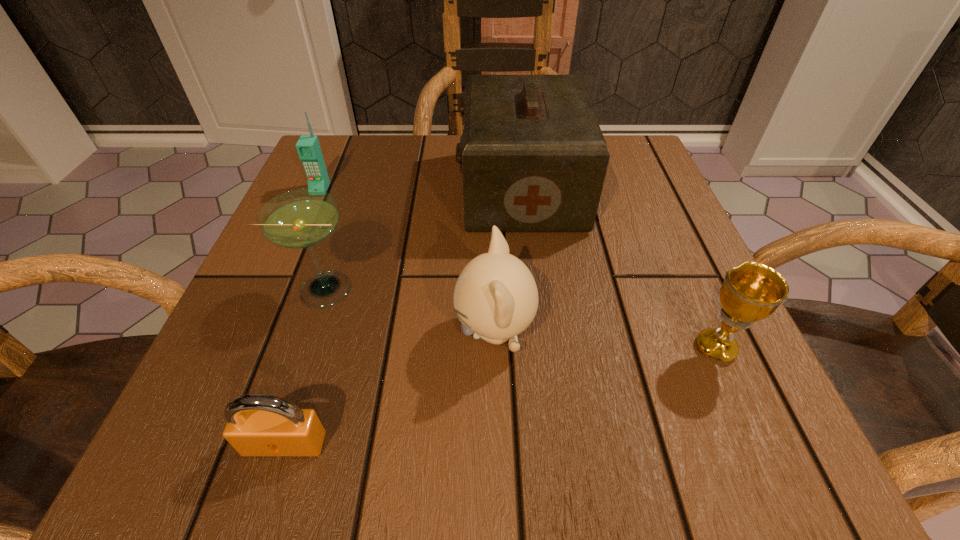
The width and height of the screenshot is (960, 540). In the image, there is a desktop. Find the location of `vacant space at the near left corner`. vacant space at the near left corner is located at coordinates (217, 407).

Image resolution: width=960 pixels, height=540 pixels. In order to click on vacant point located between the padlock and the chalice in this screenshot , I will do click(500, 396).

This screenshot has height=540, width=960. I want to click on empty space between the first-aid kit and the shortest object, so click(403, 316).

Find the location of a particular element. This screenshot has width=960, height=540. free spot between the rightmost object and the first-aid kit is located at coordinates (619, 269).

Image resolution: width=960 pixels, height=540 pixels. Find the location of `free space between the martini and the tallest object`. free space between the martini and the tallest object is located at coordinates (422, 239).

Identify the location of unoccupied area between the chalice and the tallest object. The width and height of the screenshot is (960, 540). (x=619, y=269).

This screenshot has width=960, height=540. Find the location of `free space between the nearest object and the rightmost object`. free space between the nearest object and the rightmost object is located at coordinates (500, 396).

The height and width of the screenshot is (540, 960). I want to click on free space between the cellular telephone and the first-aid kit, so click(x=421, y=190).

In order to click on vacant space that is in between the cellular telephone and the kitten in this screenshot , I will do point(407,261).

Find the location of a particular element. Image resolution: width=960 pixels, height=540 pixels. free spot between the nearest object and the cellular telephone is located at coordinates (302, 316).